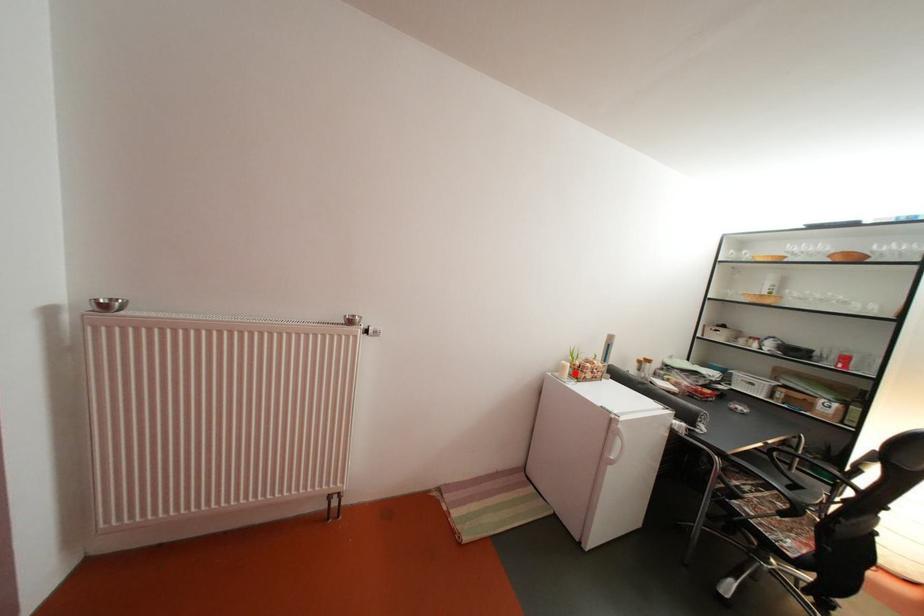
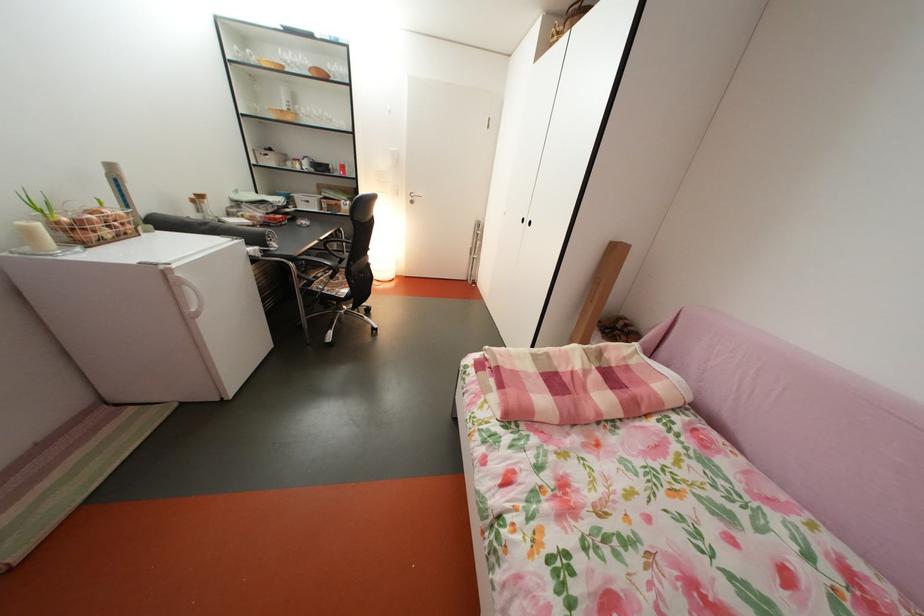
Find the pixel in the second image that matches the highlighted location in the first image.

(41, 238)